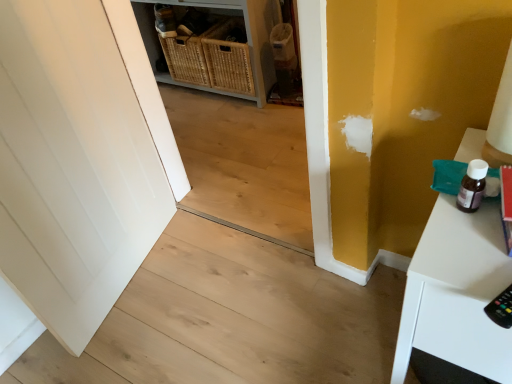
This screenshot has width=512, height=384. In order to click on free point above natural wood stair at center (from a real-world perspective) in this screenshot , I will do `click(222, 325)`.